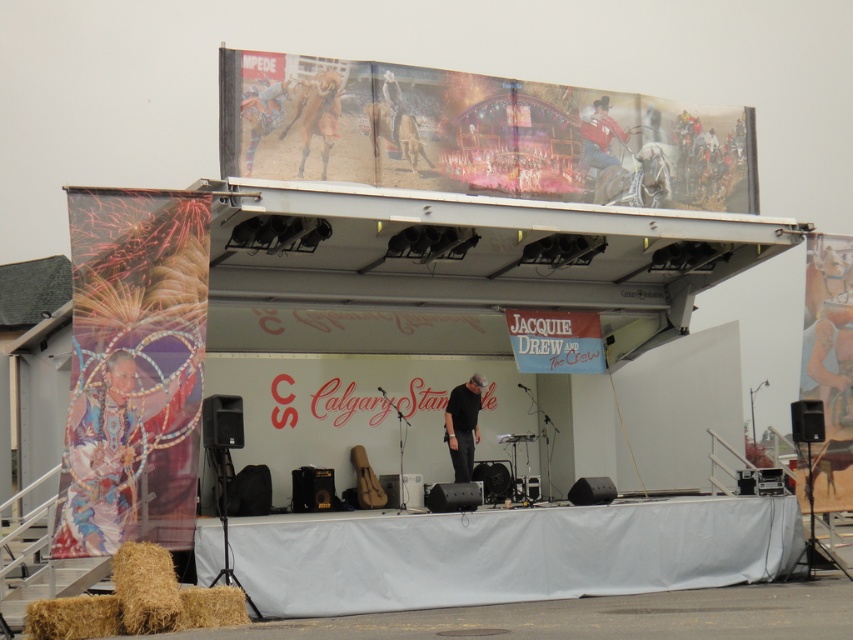
Question: Is the position of beaded fabric person at left less distant than that of black fabric at center?

Choices:
 (A) no
 (B) yes

Answer: (B)

Question: Among these objects, which one is nearest to the camera?

Choices:
 (A) red leather cowboy at center
 (B) beaded fabric person at left
 (C) black fabric at center

Answer: (B)

Question: Is black fabric at center above red leather cowboy at center?

Choices:
 (A) no
 (B) yes

Answer: (A)

Question: Which object appears farthest from the camera in this image?

Choices:
 (A) red leather cowboy at center
 (B) black fabric at center

Answer: (B)

Question: Can you confirm if black fabric at center is bigger than red leather cowboy at center?

Choices:
 (A) no
 (B) yes

Answer: (B)

Question: Which is nearer to the black fabric at center?

Choices:
 (A) red leather cowboy at center
 (B) beaded fabric person at left

Answer: (A)